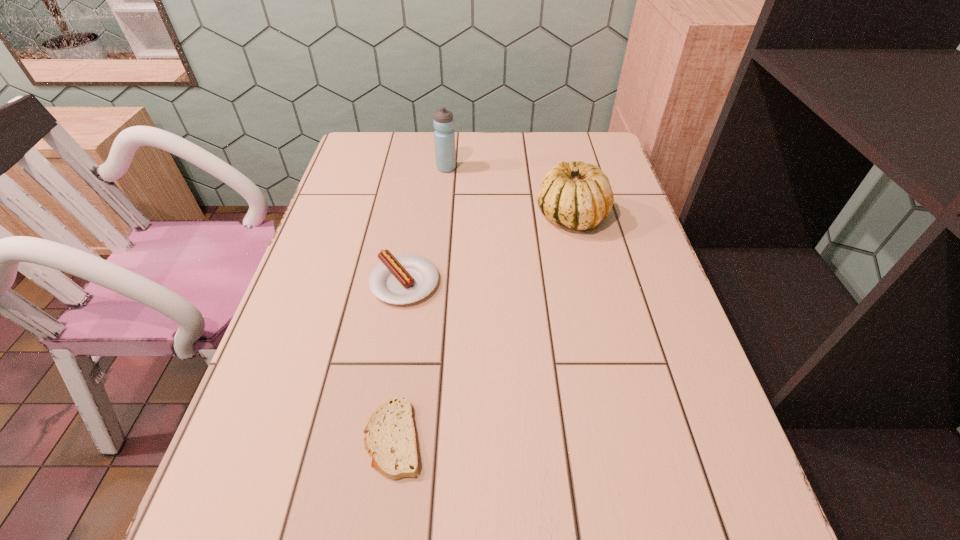
Choose which object is the nearest neighbor to the sausage. Please provide its 2D coordinates. Your answer should be formatted as a tuple, i.e. [(x, y)], where the tuple contains the x and y coordinates of a point satisfying the conditions above.

[(390, 439)]

Where is `free space that satisfies the following two spatial constraints: 1. on the back side of the rightmost object; 2. on the right side of the shortest object`? free space that satisfies the following two spatial constraints: 1. on the back side of the rightmost object; 2. on the right side of the shortest object is located at coordinates (424, 217).

What are the coordinates of `vacant area that satisfies the following two spatial constraints: 1. on the back side of the third shortest object; 2. on the left side of the third tallest object` in the screenshot? It's located at (416, 217).

Locate an element on the screen. This screenshot has height=540, width=960. free spot that satisfies the following two spatial constraints: 1. on the back side of the sausage; 2. on the left side of the second farthest object is located at coordinates (x=416, y=217).